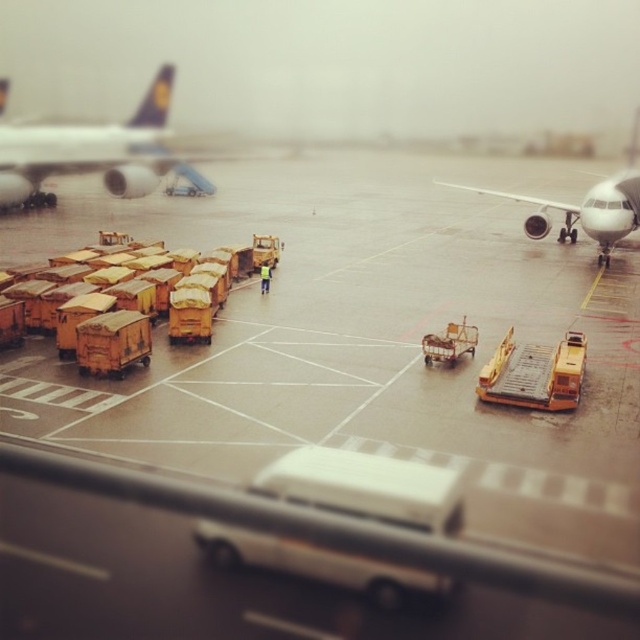
Locate an element on the screen. This screenshot has width=640, height=640. white glossy airplane at upper left is located at coordinates (100, 154).

Looking at this image, which is above, white glossy airplane at upper left or white glossy airplane at right?

white glossy airplane at upper left is above.

Which is in front, point (173, 177) or point (577, 216)?

Positioned in front is point (577, 216).

This screenshot has width=640, height=640. In order to click on white glossy airplane at upper left in this screenshot , I will do `click(100, 154)`.

Between yellow matte cargo containers at left and white glossy airplane at right, which one has more height?

white glossy airplane at right is taller.

This screenshot has height=640, width=640. What do you see at coordinates (109, 282) in the screenshot?
I see `yellow matte cargo containers at left` at bounding box center [109, 282].

Measure the distance between point (12, 296) and camera.

17.44 meters

You are a GUI agent. You are given a task and a screenshot of the screen. Output one action in this format:
    pyautogui.click(x=<x>, y=<y>)
    Task: Click on the yellow matte cargo containers at left
    The width and height of the screenshot is (640, 640).
    Given the screenshot: What is the action you would take?
    pyautogui.click(x=109, y=282)

In the scene shown: Can you confirm if white glossy airplane at upper left is positioned below metallic yellow cart at center?

Incorrect, white glossy airplane at upper left is not positioned below metallic yellow cart at center.

Is point (86, 138) positioned after point (426, 348)?

Yes, point (86, 138) is behind point (426, 348).

Between point (68, 147) and point (422, 340), which one is positioned behind?

The point (68, 147) is behind.

Identify the location of white glossy airplane at upper left. This screenshot has height=640, width=640. (100, 154).